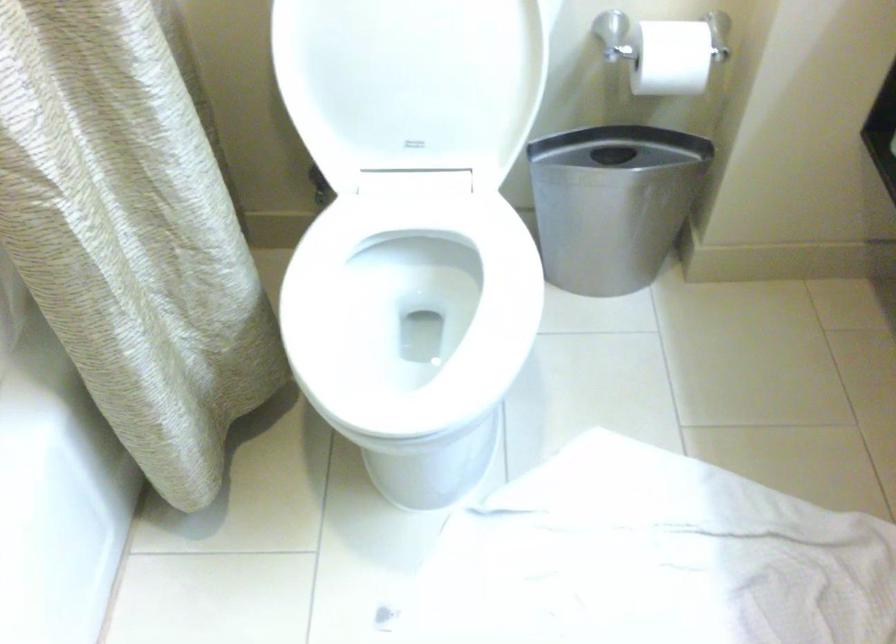
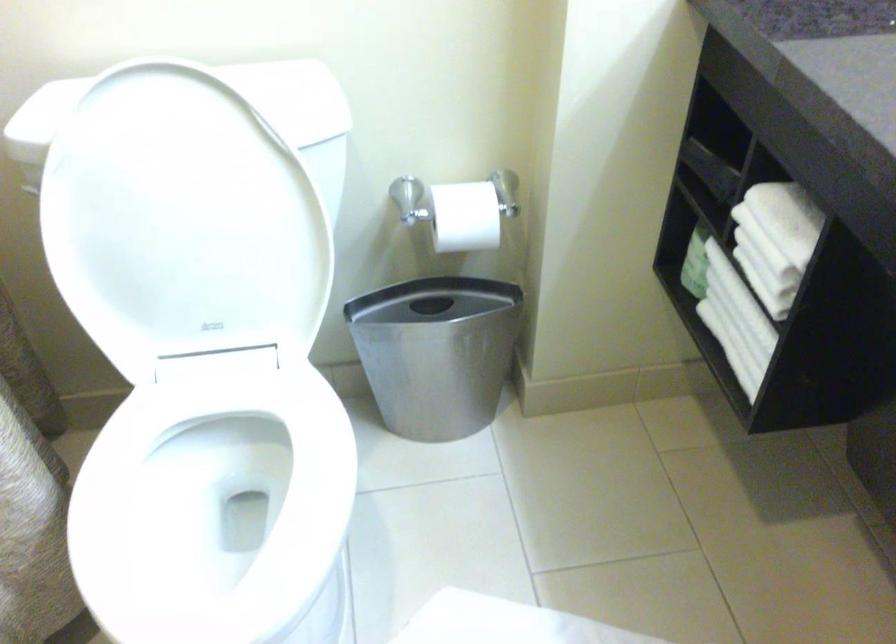
Question: The camera is either moving clockwise (left) or counter-clockwise (right) around the object. The first image is from the beginning of the video and the second image is from the end. Is the camera moving left or right when shooting the video?

Choices:
 (A) Left
 (B) Right

Answer: (A)